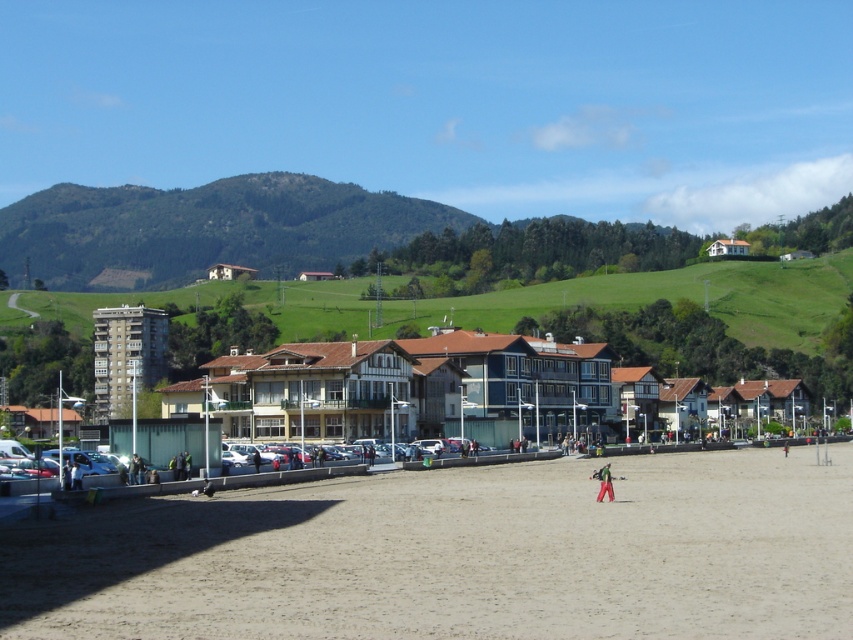
Can you confirm if gray concrete building at left is shorter than white wooden house at center?

In fact, gray concrete building at left may be taller than white wooden house at center.

Is gray concrete building at left below white wooden house at center?

Indeed, gray concrete building at left is positioned under white wooden house at center.

Between point (96, 380) and point (734, 250), which one is positioned in front?

Point (96, 380) is more forward.

At what (x,y) coordinates should I click in order to perform the action: click on gray concrete building at left. Please return your answer as a coordinate pair (x, y). The image size is (853, 640). Looking at the image, I should click on click(x=126, y=356).

Who is shorter, light brown sand at center or white wooden house at center?

light brown sand at center is shorter.

Who is more forward, (450,596) or (734,241)?

Positioned in front is point (450,596).

Locate an element on the screen. light brown sand at center is located at coordinates (457, 556).

Between point (374, 541) and point (236, 268), which one is positioned behind?

Point (236, 268)

Can you confirm if light brown sand at center is positioned to the left of brown wooden house at center?

In fact, light brown sand at center is to the right of brown wooden house at center.

Where is `light brown sand at center`? This screenshot has height=640, width=853. light brown sand at center is located at coordinates (457, 556).

In order to click on light brown sand at center in this screenshot , I will do `click(457, 556)`.